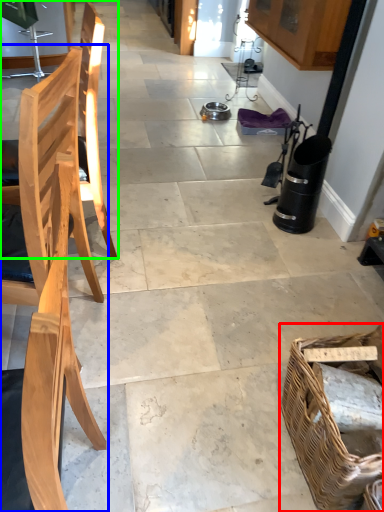
Question: Considering the real-world distances, which object is farthest from picnic basket (highlighted by a red box)? chair (highlighted by a blue box) or chair (highlighted by a green box)?

Choices:
 (A) chair
 (B) chair

Answer: (B)